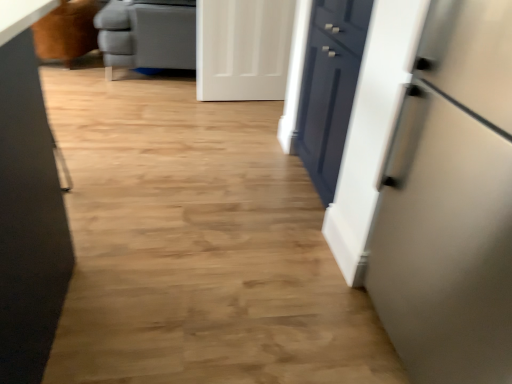
Question: From the image's perspective, is white matte door at upper center on satin white refrigerator at right?

Choices:
 (A) no
 (B) yes

Answer: (B)

Question: Does white matte door at upper center have a lesser height compared to satin white refrigerator at right?

Choices:
 (A) no
 (B) yes

Answer: (B)

Question: Could you tell me if white matte door at upper center is turned towards satin white refrigerator at right?

Choices:
 (A) no
 (B) yes

Answer: (B)

Question: Would you say satin white refrigerator at right is part of white matte door at upper center's contents?

Choices:
 (A) yes
 (B) no

Answer: (B)

Question: Is white matte door at upper center facing away from satin white refrigerator at right?

Choices:
 (A) no
 (B) yes

Answer: (A)

Question: Can you confirm if white matte door at upper center is bigger than satin white refrigerator at right?

Choices:
 (A) yes
 (B) no

Answer: (B)

Question: From the image's perspective, does brown leather armchair at upper left appear lower than gray leather ottoman at upper left?

Choices:
 (A) yes
 (B) no

Answer: (A)

Question: Is brown leather armchair at upper left facing away from gray leather ottoman at upper left?

Choices:
 (A) no
 (B) yes

Answer: (A)

Question: From a real-world perspective, is brown leather armchair at upper left physically below gray leather ottoman at upper left?

Choices:
 (A) no
 (B) yes

Answer: (B)

Question: Does brown leather armchair at upper left have a lesser height compared to gray leather ottoman at upper left?

Choices:
 (A) yes
 (B) no

Answer: (A)

Question: Is brown leather armchair at upper left not close to gray leather ottoman at upper left?

Choices:
 (A) yes
 (B) no

Answer: (B)

Question: Is brown leather armchair at upper left positioned before gray leather ottoman at upper left?

Choices:
 (A) no
 (B) yes

Answer: (A)

Question: Is satin white refrigerator at right taller than white matte door at upper center?

Choices:
 (A) yes
 (B) no

Answer: (A)